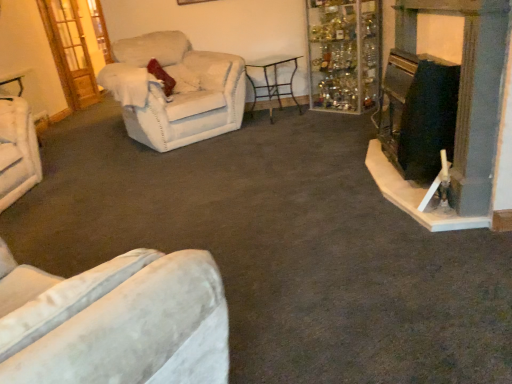
Question: Is point (154, 92) closer or farther from the camera than point (266, 64)?

Choices:
 (A) farther
 (B) closer

Answer: (B)

Question: Is beige fabric armchair at left, the 2th chair when ordered from left to right, bigger or smaller than metallic black table at center?

Choices:
 (A) small
 (B) big

Answer: (B)

Question: Which of these objects is positioned farthest from the metallic black table at center?

Choices:
 (A) clear glass cabinet at upper right
 (B) beige fabric armchair at left, the first chair viewed from the right
 (C) wooden door at upper left
 (D) velvet beige armchair at left, which is the first chair in left-to-right order
 (E) black matte fireplace at right

Answer: (C)

Question: Considering the real-world distances, which object is farthest from the metallic black table at center?

Choices:
 (A) wooden door at upper left
 (B) velvet beige armchair at left, which is the first chair in left-to-right order
 (C) clear glass cabinet at upper right
 (D) black matte fireplace at right
 (E) beige fabric armchair at left, the first chair viewed from the right

Answer: (A)